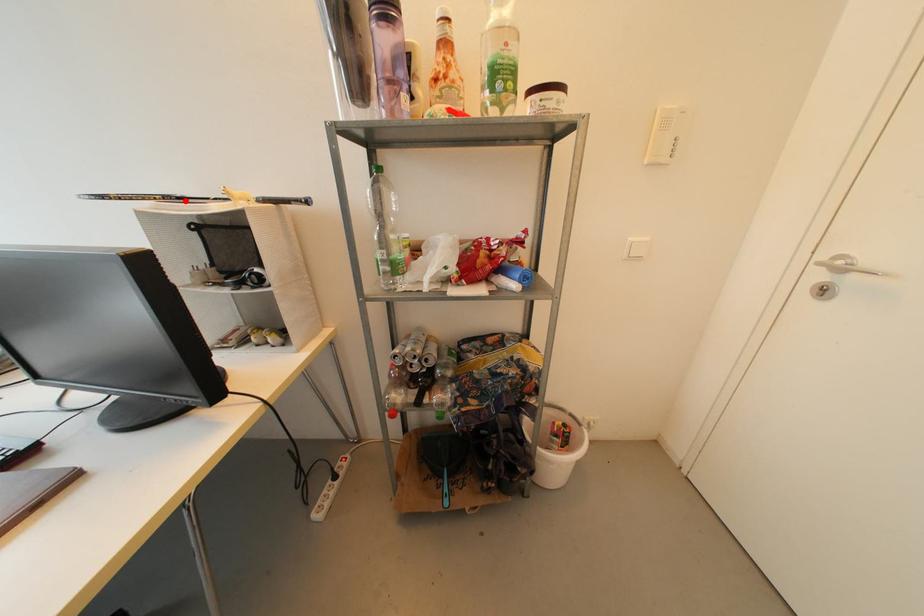
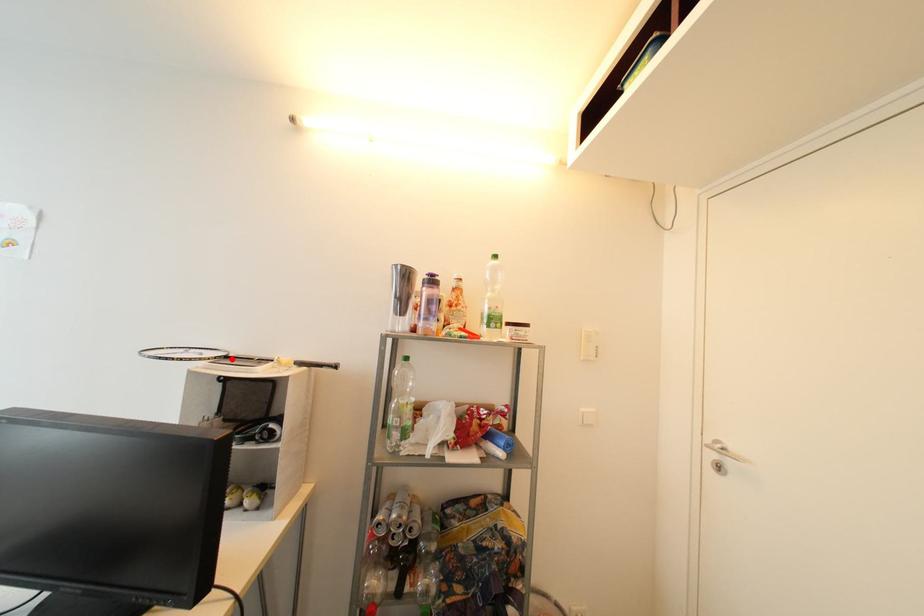
I am providing you with two images of the same scene from different viewpoints. A red point is marked on the first image and another point is marked on the second image. Are the points marked in image1 and image2 representing the same 3D position?

Yes